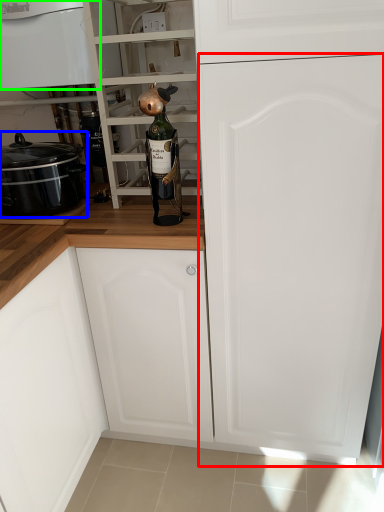
Question: Which object is the closest to the door (highlighted by a red box)? Choose among these: kitchen appliance (highlighted by a blue box) or home appliance (highlighted by a green box).

Choices:
 (A) kitchen appliance
 (B) home appliance

Answer: (A)